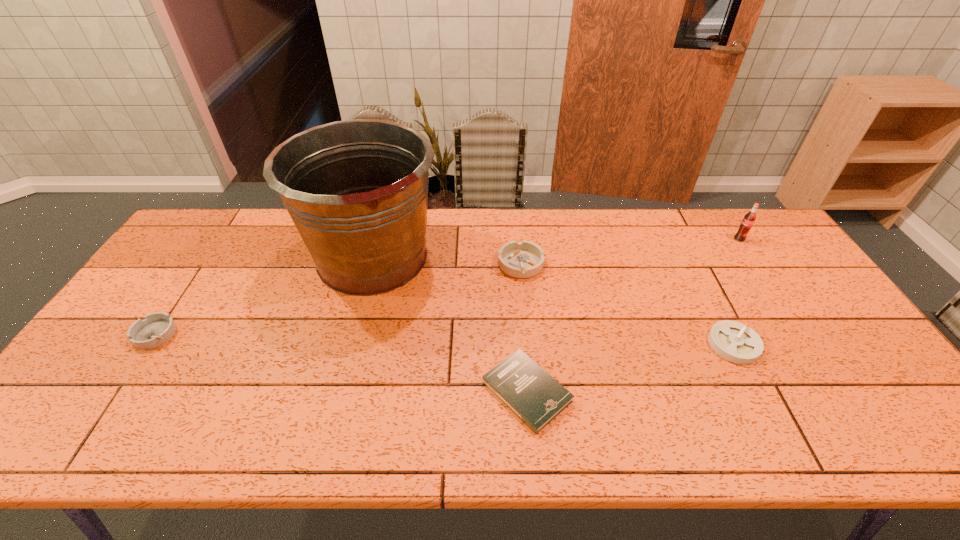
In order to click on the tallest object in this screenshot , I will do `click(357, 190)`.

I want to click on bucket, so click(x=357, y=190).

This screenshot has height=540, width=960. In order to click on the rightmost object in this screenshot , I will do `click(749, 219)`.

Locate an element on the screen. The height and width of the screenshot is (540, 960). soda bottle is located at coordinates (749, 219).

The image size is (960, 540). In order to click on the farthest ashtray in this screenshot , I will do `click(524, 259)`.

You are a GUI agent. You are given a task and a screenshot of the screen. Output one action in this format:
    pyautogui.click(x=<x>, y=<y>)
    Task: Click on the second ashtray from left to right
    The height and width of the screenshot is (540, 960).
    Given the screenshot: What is the action you would take?
    pyautogui.click(x=524, y=259)

In order to click on the leftmost object in this screenshot , I will do `click(157, 328)`.

The image size is (960, 540). Identify the location of the fifth object from left to right. (736, 342).

I want to click on the shortest object, so click(x=520, y=383).

Locate an element on the screen. Image resolution: width=960 pixels, height=540 pixels. free space located on the front of the bucket is located at coordinates (329, 420).